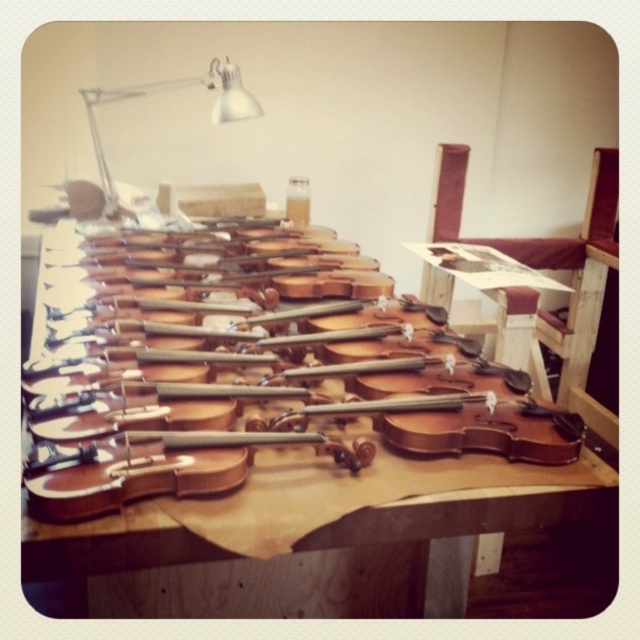
You are a violinist who needs to pack your belongings. You have a case that can only fit items smaller than the natural wood violin at center. Can you safely place the metallic silver lamp at upper left into the case?

The natural wood violin at center is bigger than the metallic silver lamp at upper left, so yes, the metallic silver lamp at upper left can be safely placed into the case since it is smaller than the violin.

You are a violinist who needs to locate your instrument on the table. The table has a coordinate system where the bottom left corner is the origin point. Can you determine the exact position of the natural wood violin at center?

The natural wood violin at center is located at the 2D coordinates of point (241, 387).

Looking at this image, you are a violin maker in the workshop. You need to place a new violin case that is 0.5 meters wide on the table. The case must be placed at point (241, 387). Can you fit the case there without overlapping any existing objects?

At point (241, 387) lies natural wood violin at center. Since the violin is already at that location, placing the case there would overlap the existing violin. Choose another spot on the table.